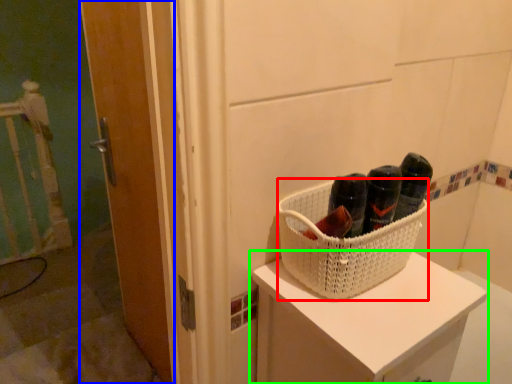
Question: Which object is the closest to the basket (highlighted by a red box)? Choose among these: door (highlighted by a blue box) or furniture (highlighted by a green box).

Choices:
 (A) door
 (B) furniture

Answer: (B)